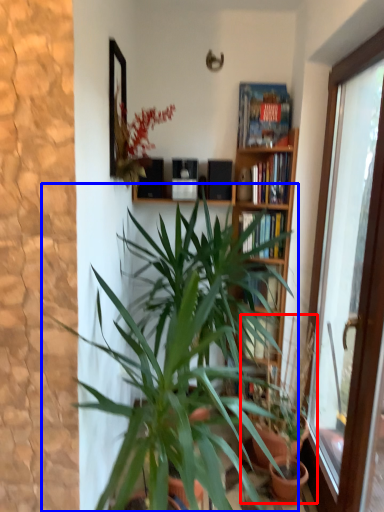
Question: Which of the following is the farthest to the observer, houseplant (highlighted by a red box) or houseplant (highlighted by a blue box)?

Choices:
 (A) houseplant
 (B) houseplant

Answer: (A)